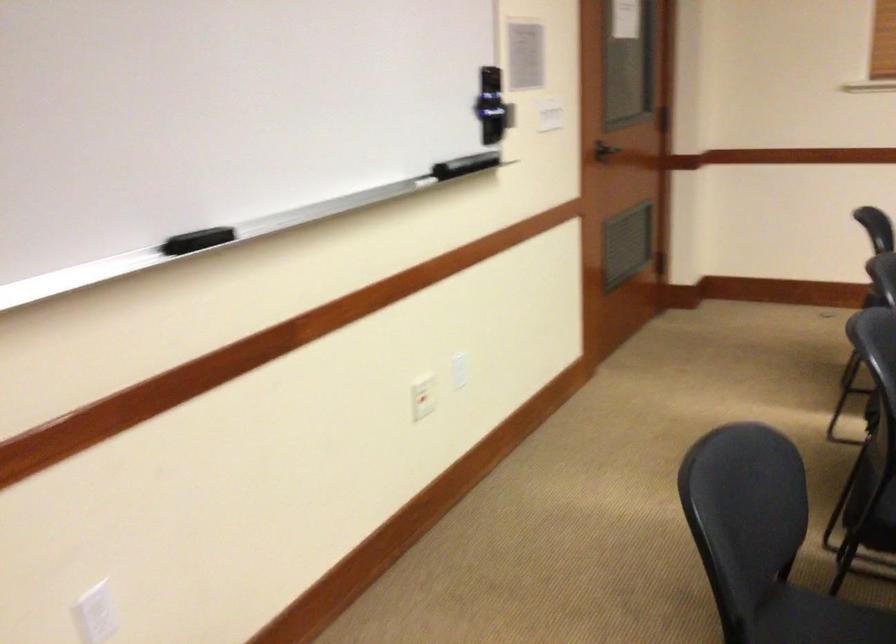
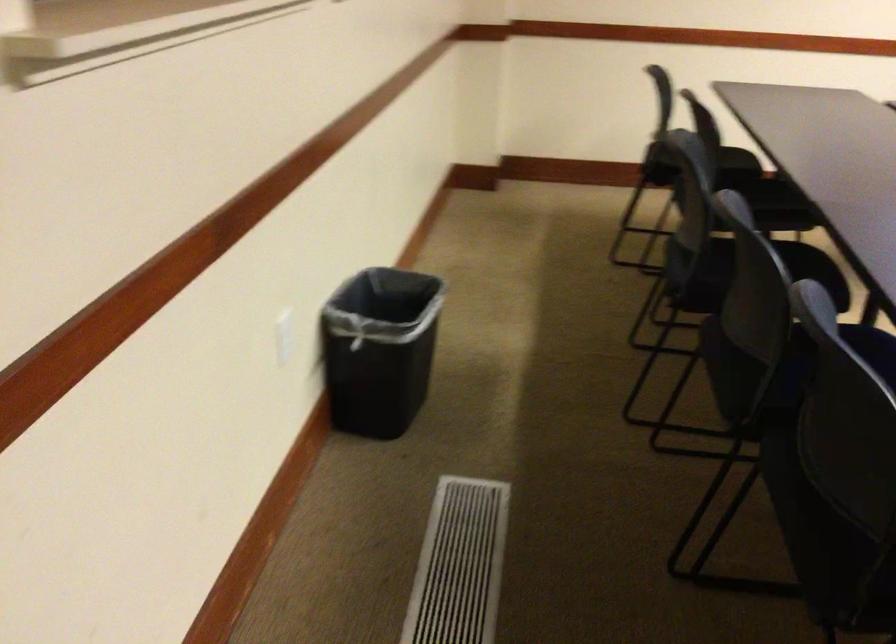
The images are taken continuously from a first-person perspective. In which direction is your viewpoint rotating?

The camera rotated toward right-down.